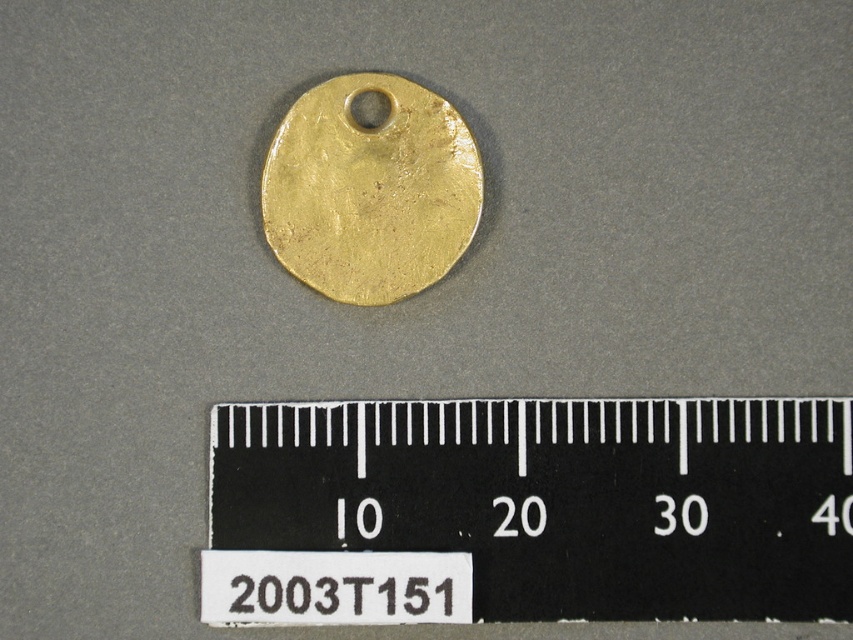
Question: From the image, what is the correct spatial relationship of black plastic ruler at center in relation to gold matte disc at center?

Choices:
 (A) below
 (B) above

Answer: (A)

Question: Can you confirm if black plastic ruler at center is smaller than gold matte disc at center?

Choices:
 (A) yes
 (B) no

Answer: (B)

Question: Can you confirm if black plastic ruler at center is positioned to the right of gold matte disc at center?

Choices:
 (A) no
 (B) yes

Answer: (B)

Question: Which point is closer to the camera?

Choices:
 (A) (299, 122)
 (B) (808, 444)

Answer: (B)

Question: Which object is closer to the camera taking this photo?

Choices:
 (A) black plastic ruler at center
 (B) gold matte disc at center

Answer: (A)